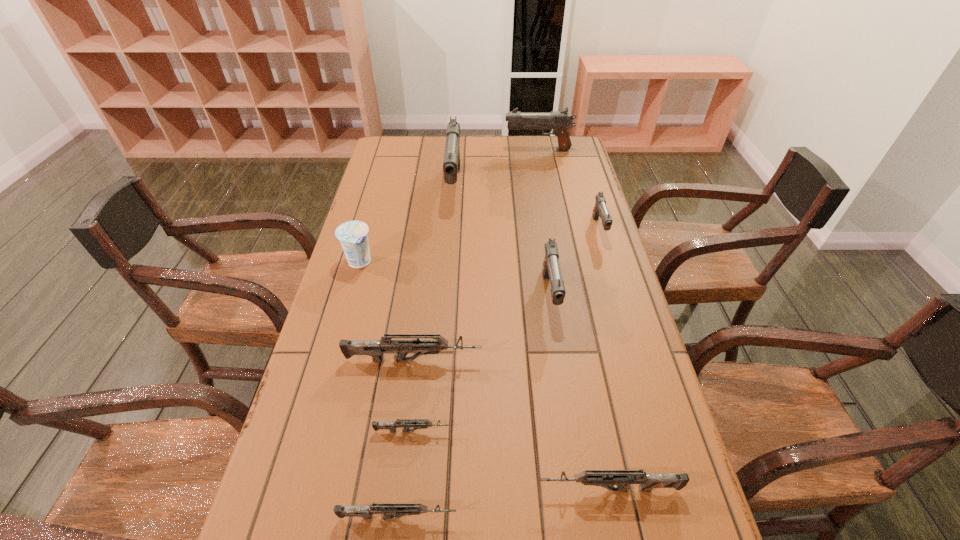
You are a GUI agent. You are given a task and a screenshot of the screen. Output one action in this format:
    pyautogui.click(x=<x>, y=<y>)
    Task: Click on the yogurt that is at the left edge
    Image resolution: width=960 pixels, height=540 pixels.
    Given the screenshot: What is the action you would take?
    pyautogui.click(x=353, y=235)

Find the location of a particular element. The width and height of the screenshot is (960, 540). object located at the far right corner is located at coordinates (560, 121).

Where is `vacant space at the far edge of the desktop`? The image size is (960, 540). vacant space at the far edge of the desktop is located at coordinates (466, 164).

What are the coordinates of `vacant space at the left edge of the desktop` in the screenshot? It's located at (406, 188).

Locate an element on the screen. The height and width of the screenshot is (540, 960). free space at the right edge of the desktop is located at coordinates (590, 206).

At what (x,y) coordinates should I click in order to perform the action: click on free space at the far left corner. Please return your answer as a coordinate pair (x, y). The image size is (960, 540). Looking at the image, I should click on point(403,157).

The image size is (960, 540). Identify the location of vacant space at the far right corner of the desktop. (567, 151).

The height and width of the screenshot is (540, 960). What are the coordinates of `vacant space that is in between the blue yogurt and the second shortest gun` in the screenshot? It's located at (379, 390).

Identify the location of empty location between the second nearest grey gun and the blue yogurt. (484, 376).

Locate an element on the screen. vacant space that's between the yogurt and the tallest gun is located at coordinates (407, 224).